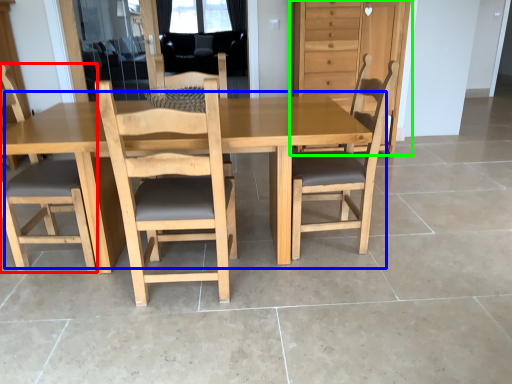
Question: Which is farther away from chair (highlighted by a red box)? table (highlighted by a blue box) or dresser (highlighted by a green box)?

Choices:
 (A) table
 (B) dresser

Answer: (B)